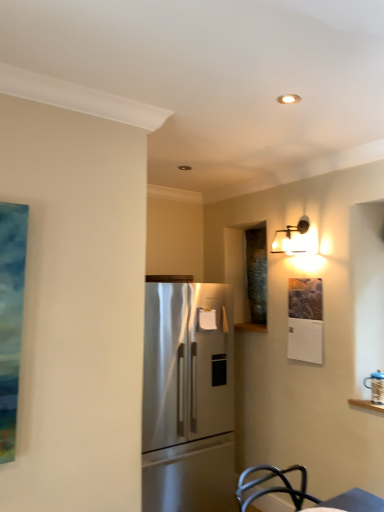
Question: From a real-world perspective, is matte black sconce at upper right beneath satin stainless steel refrigerator at center?

Choices:
 (A) yes
 (B) no

Answer: (B)

Question: Is satin stainless steel refrigerator at center a part of matte black sconce at upper right?

Choices:
 (A) yes
 (B) no

Answer: (B)

Question: From the image's perspective, is matte black sconce at upper right on satin stainless steel refrigerator at center?

Choices:
 (A) yes
 (B) no

Answer: (A)

Question: Is matte black sconce at upper right oriented towards satin stainless steel refrigerator at center?

Choices:
 (A) no
 (B) yes

Answer: (A)

Question: Is the position of matte black sconce at upper right less distant than that of satin stainless steel refrigerator at center?

Choices:
 (A) no
 (B) yes

Answer: (A)

Question: Is matte black sconce at upper right completely or partially outside of satin stainless steel refrigerator at center?

Choices:
 (A) yes
 (B) no

Answer: (A)

Question: Would you say satin stainless steel refrigerator at center contains matte black sconce at upper right?

Choices:
 (A) no
 (B) yes

Answer: (A)

Question: Can you confirm if satin stainless steel refrigerator at center is shorter than matte black sconce at upper right?

Choices:
 (A) yes
 (B) no

Answer: (B)

Question: Is satin stainless steel refrigerator at center behind matte black sconce at upper right?

Choices:
 (A) no
 (B) yes

Answer: (A)

Question: Is satin stainless steel refrigerator at center bigger than matte black sconce at upper right?

Choices:
 (A) yes
 (B) no

Answer: (A)

Question: From the image's perspective, would you say satin stainless steel refrigerator at center is shown under matte black sconce at upper right?

Choices:
 (A) yes
 (B) no

Answer: (A)

Question: From the image's perspective, is satin stainless steel refrigerator at center above matte black sconce at upper right?

Choices:
 (A) yes
 (B) no

Answer: (B)

Question: Considering the positions of satin stainless steel refrigerator at center and matte black sconce at upper right in the image, is satin stainless steel refrigerator at center taller or shorter than matte black sconce at upper right?

Choices:
 (A) tall
 (B) short

Answer: (A)